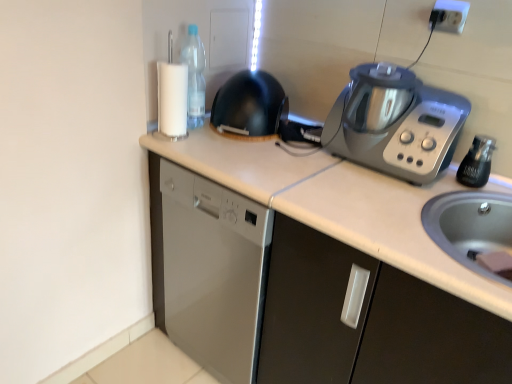
Question: Considering the relative positions of black matte wok at center and silver metallic kitchen appliance at upper right in the image provided, is black matte wok at center to the left or to the right of silver metallic kitchen appliance at upper right?

Choices:
 (A) right
 (B) left

Answer: (B)

Question: From the image's perspective, is black matte wok at center above or below silver metallic kitchen appliance at upper right?

Choices:
 (A) above
 (B) below

Answer: (A)

Question: Based on their relative distances, which object is farther from the black glass bottle at right, which is counted as the 2th bottle, starting from the left?

Choices:
 (A) black matte wok at center
 (B) silver metallic kitchen appliance at upper right
 (C) transparent plastic bottle at upper left, positioned as the 2th bottle in bottom-to-top order
 (D) white matte countertop at center
 (E) white plastic electric outlet at upper right

Answer: (C)

Question: Considering the real-world distances, which object is closest to the transparent plastic bottle at upper left, positioned as the 2th bottle in bottom-to-top order?

Choices:
 (A) black glass bottle at right, which is the first bottle from front to back
 (B) black matte wok at center
 (C) silver metallic kitchen appliance at upper right
 (D) white matte countertop at center
 (E) white plastic electric outlet at upper right

Answer: (B)